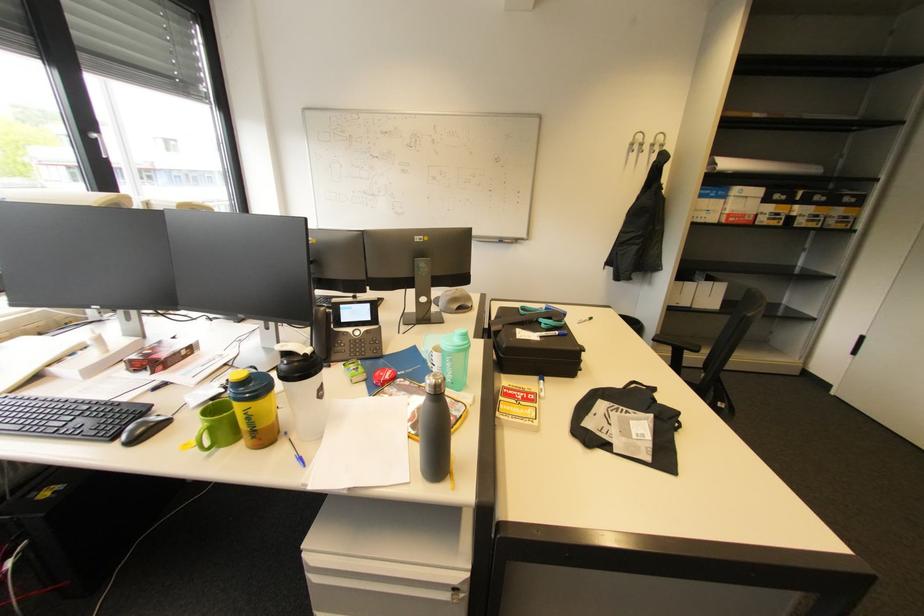
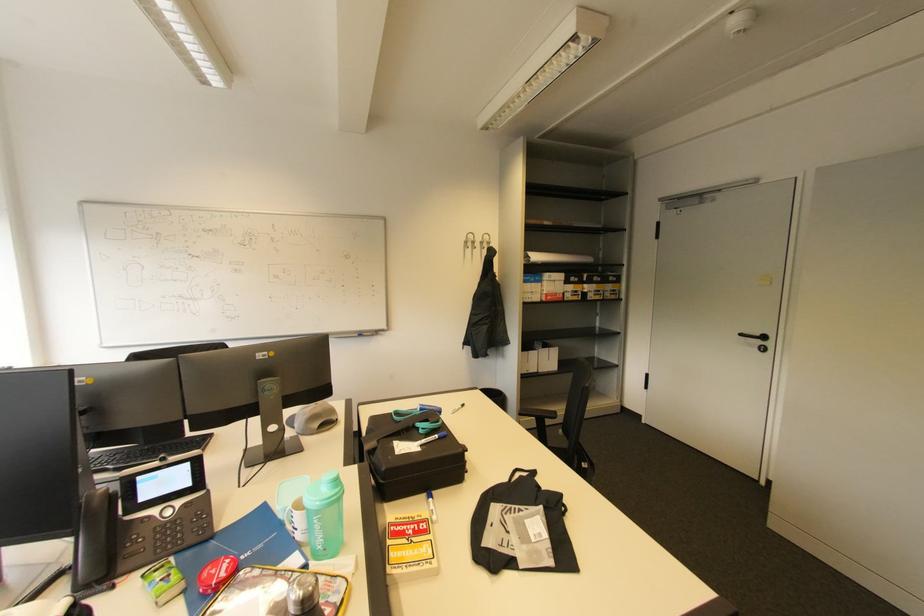
Find the pixel in the second image that matches point 562,333 in the first image.

(441, 437)